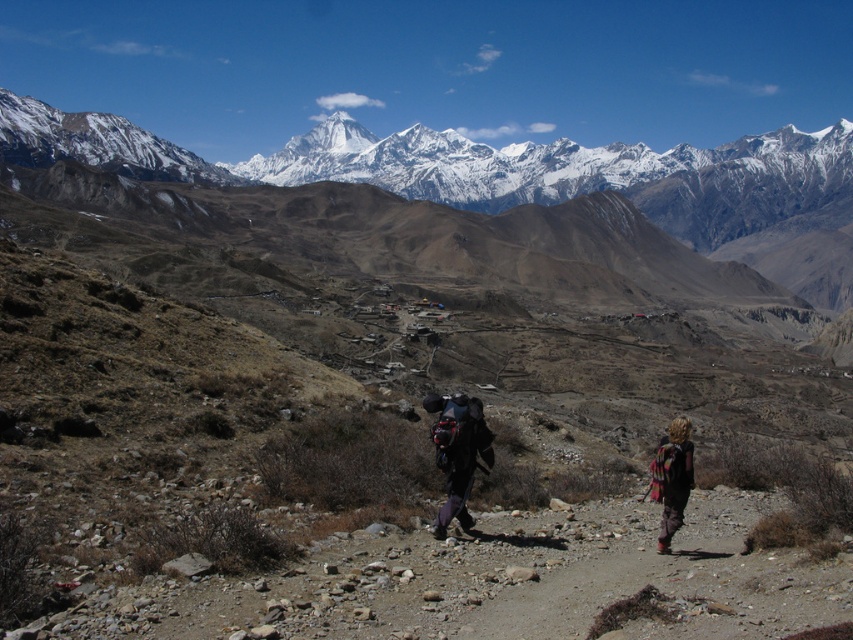
Question: Can you confirm if dark gray backpack at center is positioned to the left of matte black backpack at center?

Choices:
 (A) no
 (B) yes

Answer: (A)

Question: Which point is farther to the camera?

Choices:
 (A) matte black backpack at center
 (B) dark gray backpack at center
 (C) multicolored woven blanket at lower right

Answer: (A)

Question: Can you confirm if dark gray backpack at center is bigger than multicolored woven blanket at lower right?

Choices:
 (A) yes
 (B) no

Answer: (A)

Question: Estimate the real-world distances between objects in this image. Which object is farther from the matte black backpack at center?

Choices:
 (A) multicolored woven blanket at lower right
 (B) dark gray backpack at center

Answer: (A)

Question: Can you confirm if dark gray backpack at center is smaller than multicolored woven blanket at lower right?

Choices:
 (A) no
 (B) yes

Answer: (A)

Question: Which is nearer to the multicolored woven blanket at lower right?

Choices:
 (A) dark gray backpack at center
 (B) matte black backpack at center

Answer: (A)